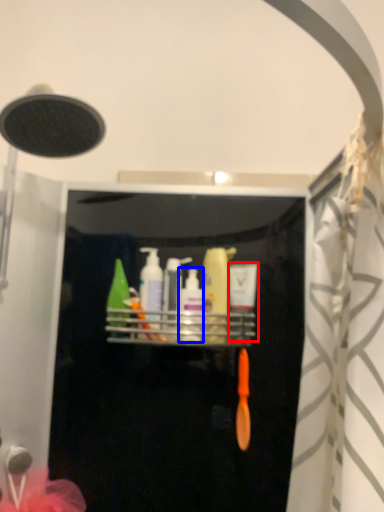
Question: Which object appears closest to the camera in this image, toiletry (highlighted by a red box) or toiletry (highlighted by a blue box)?

Choices:
 (A) toiletry
 (B) toiletry

Answer: (B)